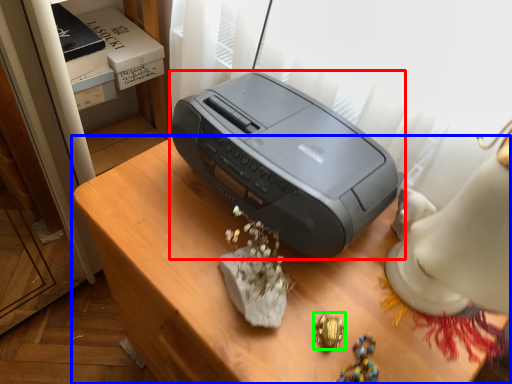
Question: Estimate the real-world distances between objects in this image. Which object is closer to printer (highlighted by a red box), furniture (highlighted by a blue box) or jewellery (highlighted by a green box)?

Choices:
 (A) furniture
 (B) jewellery

Answer: (A)